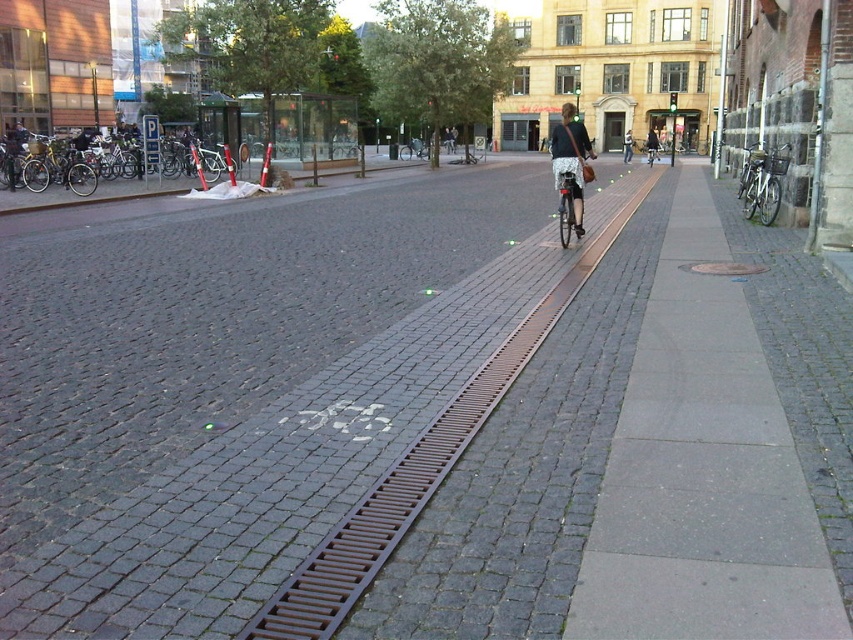
Question: Does matte black bicycle at center appear over silver metallic bicycle at center?

Choices:
 (A) yes
 (B) no

Answer: (A)

Question: Which point is farther to the camera?

Choices:
 (A) silver metallic bicycle at right
 (B) matte black bicycle at center
 (C) dark blue jeans at center
 (D) shiny silver bicycle at center

Answer: (D)

Question: Estimate the real-world distances between objects in this image. Which object is closer to the matte black bicycle at center?

Choices:
 (A) shiny silver bicycle at center
 (B) silver metallic bicycle at center
 (C) dark blue jeans at center
 (D) dark gray jacket at center

Answer: (B)

Question: Does shiny silver bicycle at center have a larger size compared to dark gray jacket at center?

Choices:
 (A) no
 (B) yes

Answer: (A)

Question: Where is matte black bicycle at center located in relation to silver metallic bicycle at center in the image?

Choices:
 (A) right
 (B) left

Answer: (A)

Question: Which of the following is the closest to the observer?

Choices:
 (A) dark gray jacket at center
 (B) silver metallic bicycle at right
 (C) dark blue jeans at center

Answer: (B)